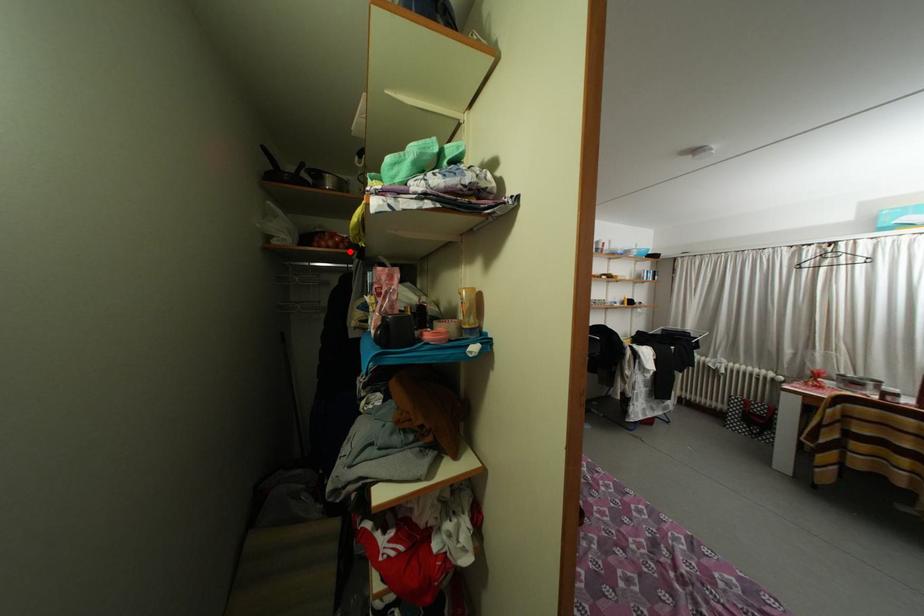
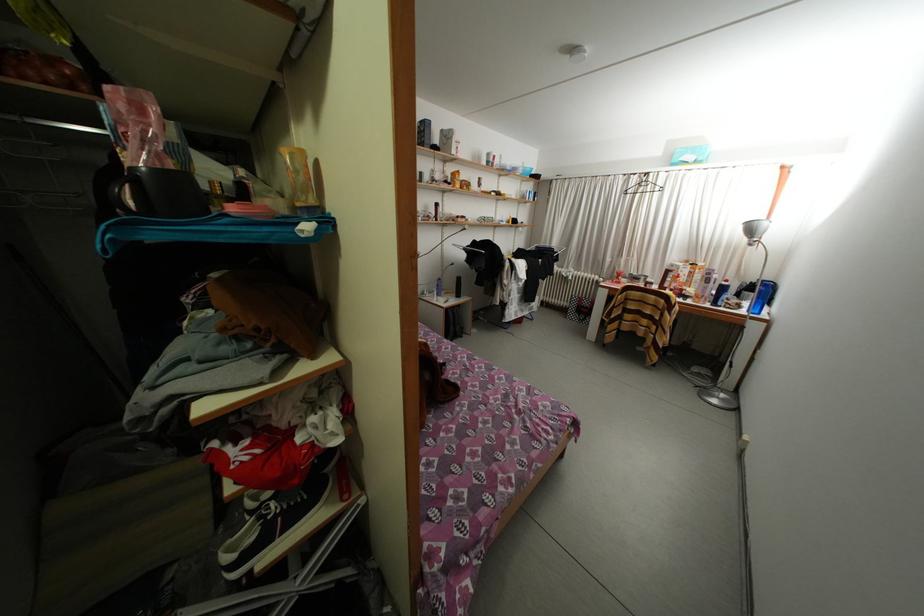
Question: A red point is marked in image1. In image2, is the corresponding 3D point closer to the camera or farther? Reply with the corresponding letter.

Choices:
 (A) The corresponding 3D point is closer.
 (B) The corresponding 3D point is farther.

Answer: (B)